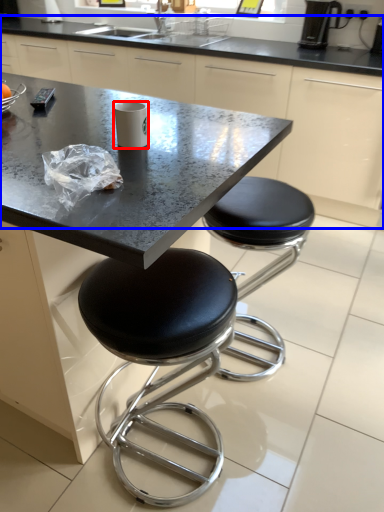
Question: Which point is closer to the camera, paper cup (highlighted by a red box) or counter (highlighted by a blue box)?

Choices:
 (A) paper cup
 (B) counter

Answer: (A)